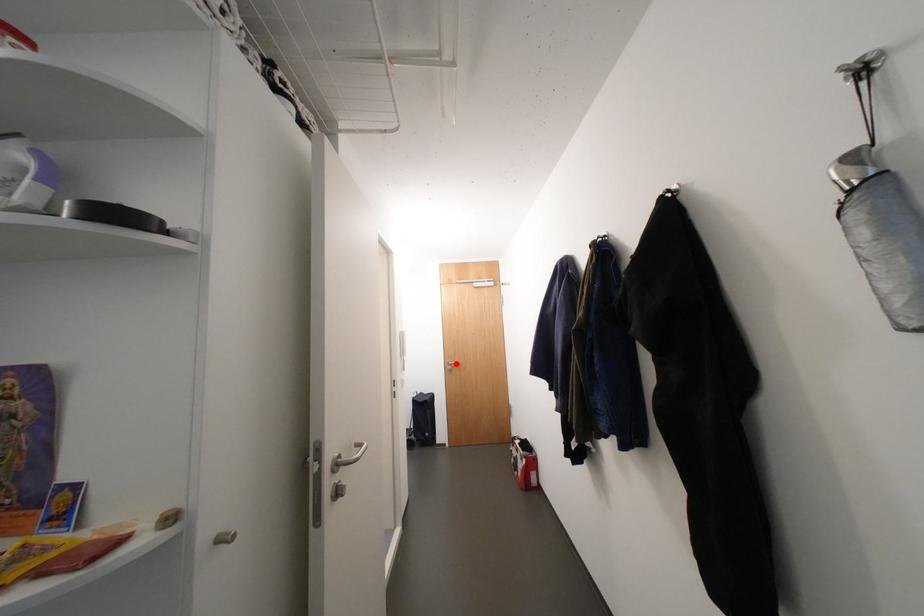
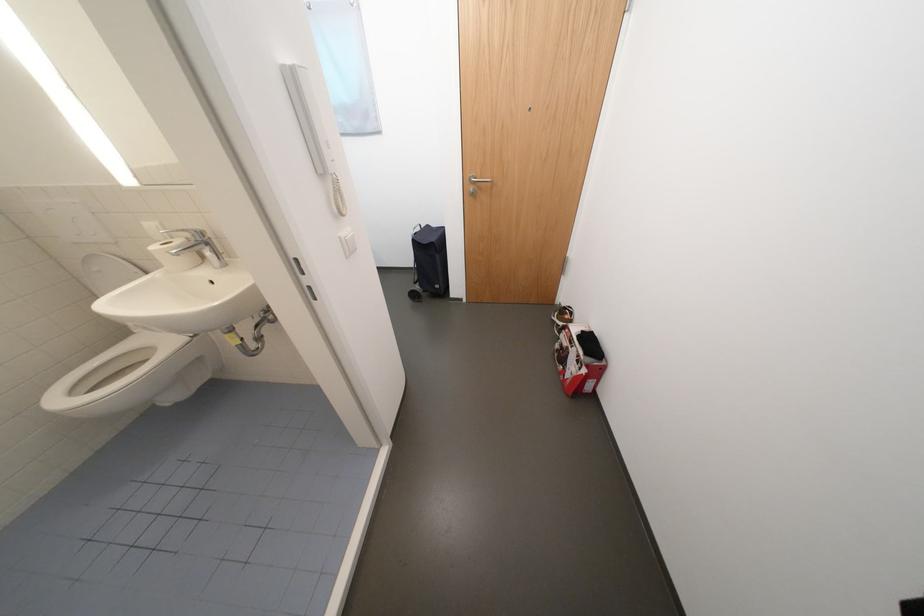
The point at the highlighted location is marked in the first image. Where is the corresponding point in the second image?

(478, 180)